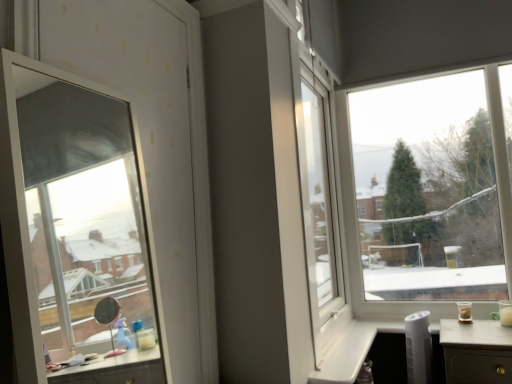
Question: Are transparent glass window at left, the second window viewed from the back, and transparent glass window at upper right, which is the 1th window from back to front, far apart?

Choices:
 (A) yes
 (B) no

Answer: (A)

Question: Does transparent glass window at left, arranged as the 1th window when viewed from the front, have a smaller size compared to transparent glass window at upper right, which is counted as the second window, starting from the left?

Choices:
 (A) no
 (B) yes

Answer: (B)

Question: Is transparent glass window at left, which appears as the 1th window when viewed from the left, at the left side of transparent glass window at upper right, the 1th window when ordered from right to left?

Choices:
 (A) no
 (B) yes

Answer: (B)

Question: From a real-world perspective, is transparent glass window at left, which is counted as the 2th window, starting from the right, over transparent glass window at upper right, the second window positioned from the front?

Choices:
 (A) yes
 (B) no

Answer: (A)

Question: From a real-world perspective, is transparent glass window at left, which is counted as the 2th window, starting from the right, physically below transparent glass window at upper right, which is the 1th window from back to front?

Choices:
 (A) yes
 (B) no

Answer: (B)

Question: Does transparent glass window at left, arranged as the 1th window when viewed from the front, have a lesser height compared to transparent glass window at upper right, which is the 1th window from back to front?

Choices:
 (A) yes
 (B) no

Answer: (A)

Question: Considering the relative sizes of transparent glass window at upper right, which is counted as the second window, starting from the left, and transparent glass window at left, the second window viewed from the back, in the image provided, is transparent glass window at upper right, which is counted as the second window, starting from the left, wider than transparent glass window at left, the second window viewed from the back,?

Choices:
 (A) yes
 (B) no

Answer: (A)

Question: Does transparent glass window at upper right, the 1th window when ordered from right to left, contain transparent glass window at left, which appears as the 1th window when viewed from the left?

Choices:
 (A) no
 (B) yes

Answer: (A)

Question: Does transparent glass window at upper right, the 1th window when ordered from right to left, appear on the right side of transparent glass window at left, arranged as the 1th window when viewed from the front?

Choices:
 (A) yes
 (B) no

Answer: (A)

Question: Does transparent glass window at upper right, the second window positioned from the front, have a lesser width compared to transparent glass window at left, arranged as the 1th window when viewed from the front?

Choices:
 (A) yes
 (B) no

Answer: (B)

Question: From a real-world perspective, is transparent glass window at upper right, the 1th window when ordered from right to left, below transparent glass window at left, which appears as the 1th window when viewed from the left?

Choices:
 (A) yes
 (B) no

Answer: (A)

Question: Could you tell me if transparent glass window at upper right, which is counted as the second window, starting from the left, is turned towards transparent glass window at left, arranged as the 1th window when viewed from the front?

Choices:
 (A) no
 (B) yes

Answer: (B)

Question: Considering the relative positions of transparent glass window at upper right, which is counted as the second window, starting from the left, and transparent glass window at left, the second window viewed from the back, in the image provided, is transparent glass window at upper right, which is counted as the second window, starting from the left, to the left or to the right of transparent glass window at left, the second window viewed from the back,?

Choices:
 (A) right
 (B) left

Answer: (A)